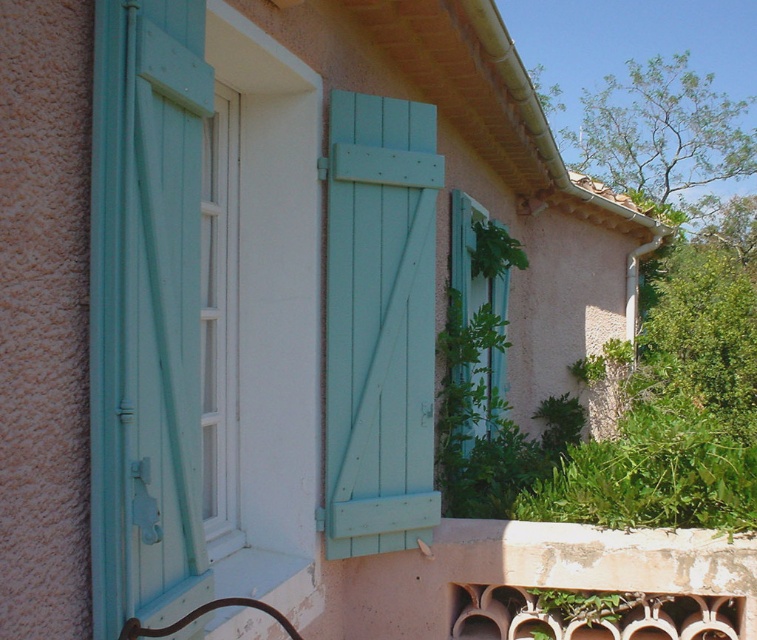
Question: Which point appears closest to the camera in this image?

Choices:
 (A) (379, 525)
 (B) (235, 99)
 (C) (620, 493)

Answer: (B)

Question: Which point is farther from the camera taking this photo?

Choices:
 (A) (594, 516)
 (B) (347, 454)
 (C) (494, 387)

Answer: (C)

Question: Among these points, which one is farthest from the camera?

Choices:
 (A) (503, 262)
 (B) (675, 525)
 (C) (223, 326)
 (D) (117, 545)

Answer: (A)

Question: Does teal wood shutter at left lie behind white wood window at center?

Choices:
 (A) yes
 (B) no

Answer: (B)

Question: Is teal wood shutter at left positioned behind green leafy plant at lower right?

Choices:
 (A) yes
 (B) no

Answer: (B)

Question: Can you confirm if light blue wood shutter at center is positioned to the right of green leafy plant at lower right?

Choices:
 (A) no
 (B) yes

Answer: (A)